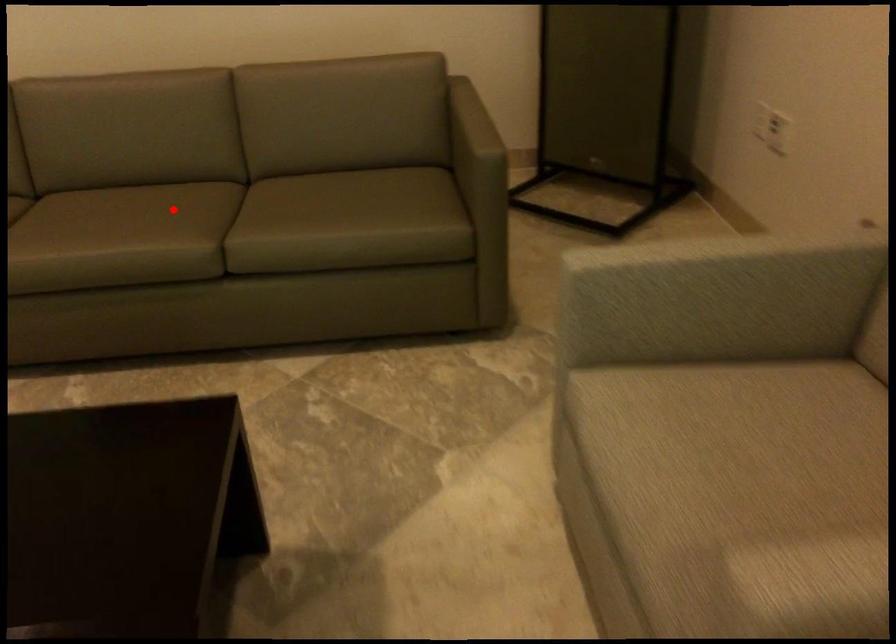
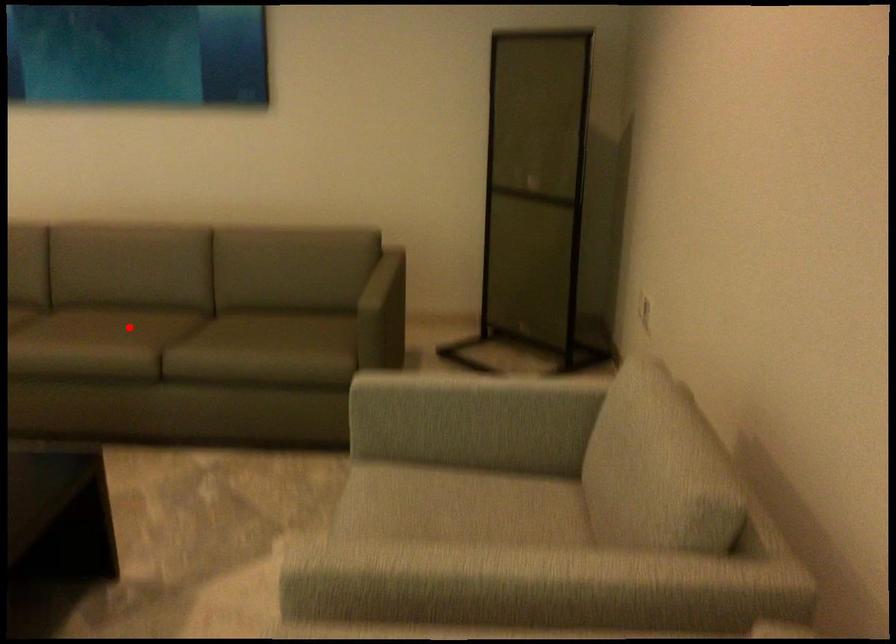
I am providing you with two images of the same scene from different viewpoints. A red point is marked on the first image and another point is marked on the second image. Are the points marked in image1 and image2 representing the same 3D position?

Yes